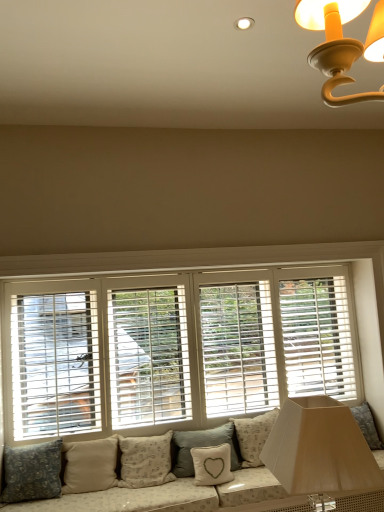
Question: Is point (94, 458) positioned closer to the camera than point (200, 450)?

Choices:
 (A) closer
 (B) farther

Answer: (B)

Question: Based on their sizes in the image, would you say beige fabric pillow at lower center, marked as the 5th pillow in a right-to-left arrangement, is bigger or smaller than white fabric pillow with heart design at lower center, which appears as the second pillow when viewed from the right?

Choices:
 (A) small
 (B) big

Answer: (B)

Question: Estimate the real-world distances between objects in this image. Which object is closer to the light gray textured pillow at center, arranged as the third pillow when viewed from the right?

Choices:
 (A) fluffy white pillow at lower center, the sixth pillow in the left-to-right sequence
 (B) beige fabric pillow at center, positioned as the 3th pillow in left-to-right order
 (C) white fabric pillow with heart design at lower center, which appears as the second pillow when viewed from the right
 (D) dark gray fabric pillow at lower left, acting as the sixth pillow starting from the right
 (E) matte white lampshade at lower right

Answer: (C)

Question: Which object is positioned farthest from the dark gray fabric pillow at lower left, acting as the sixth pillow starting from the right?

Choices:
 (A) white wood blinds at center
 (B) light gray textured pillow at center, placed as the fourth pillow when sorted from left to right
 (C) white fabric pillow with heart design at lower center, which appears as the second pillow when viewed from the right
 (D) fluffy white pillow at lower center, the first pillow viewed from the right
 (E) beige fabric pillow at lower center, which is the 2th pillow in left-to-right order

Answer: (D)